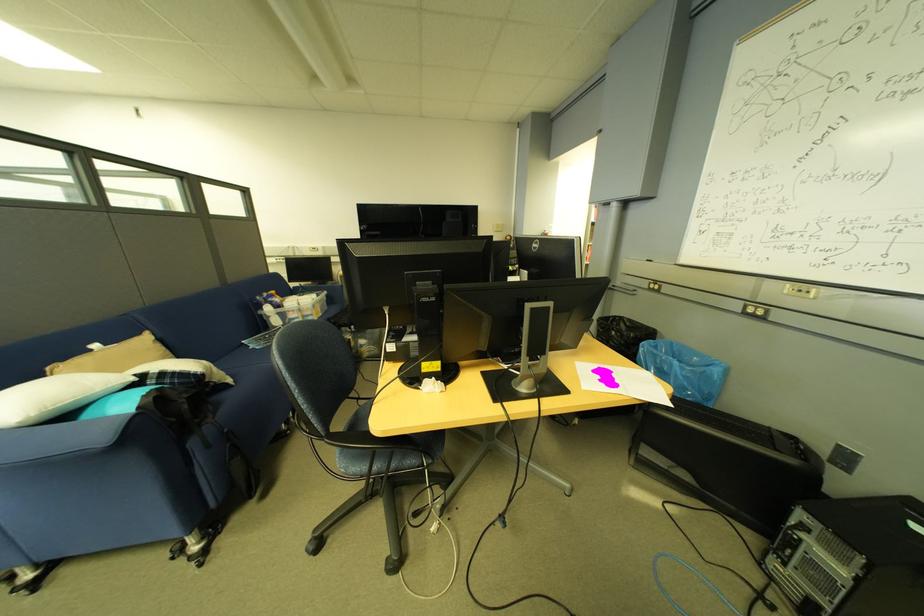
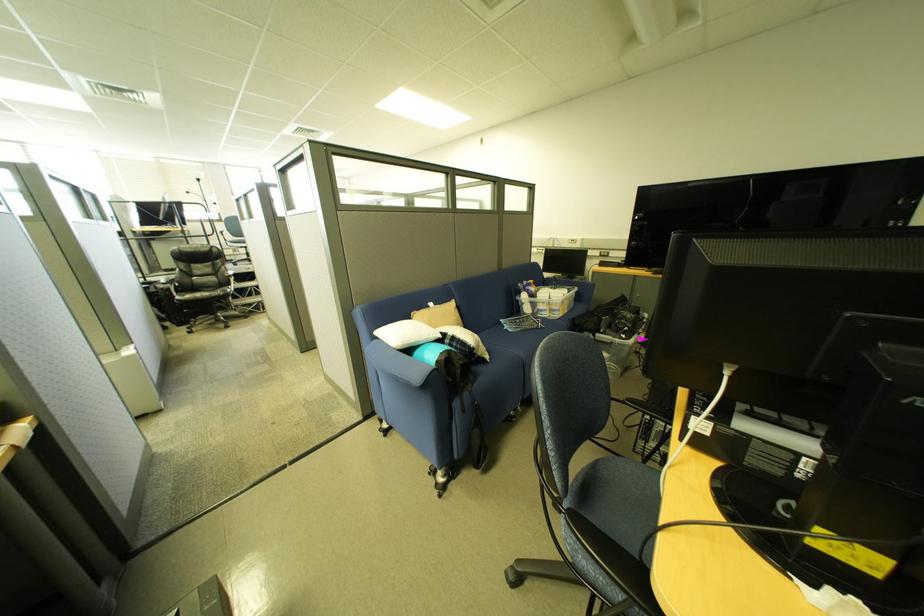
In the second image, find the point that corresponds to point (219, 448) in the first image.

(475, 413)